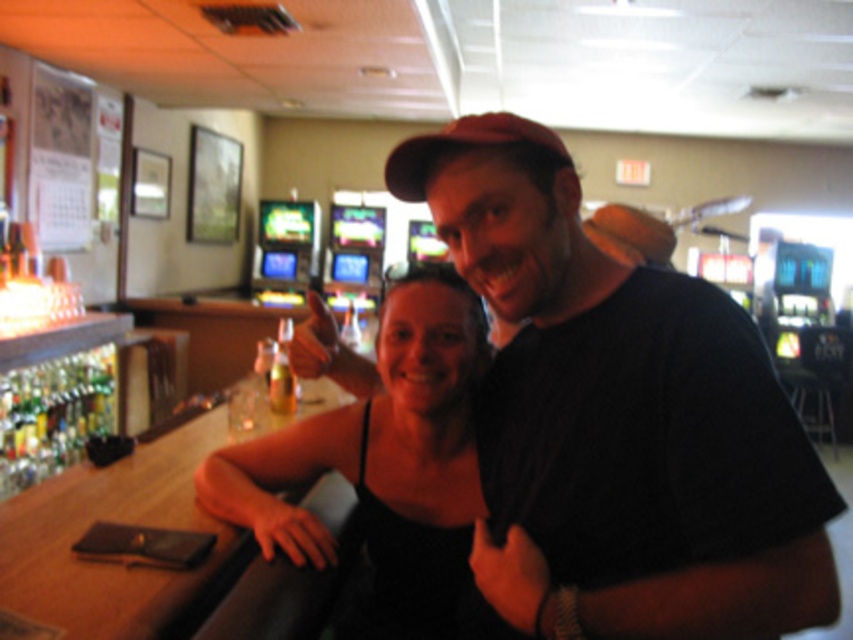
You are a bartender preparing to serve a customer. You see the black fabric dress at center and the translucent glass bottle at bar. Which item requires more space to store?

The black fabric dress at center requires more space to store because it is larger in size than the translucent glass bottle at bar.